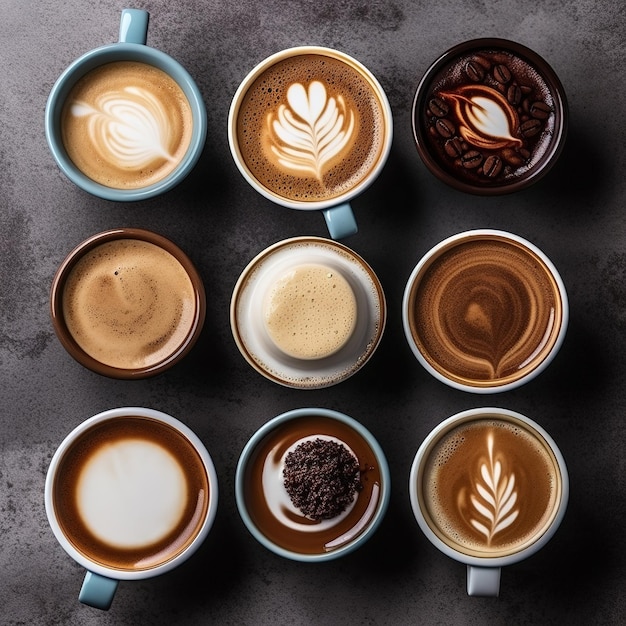
Find the location of a particular element. Image resolution: width=626 pixels, height=626 pixels. mug handles is located at coordinates (342, 217), (128, 23), (491, 583), (89, 600).